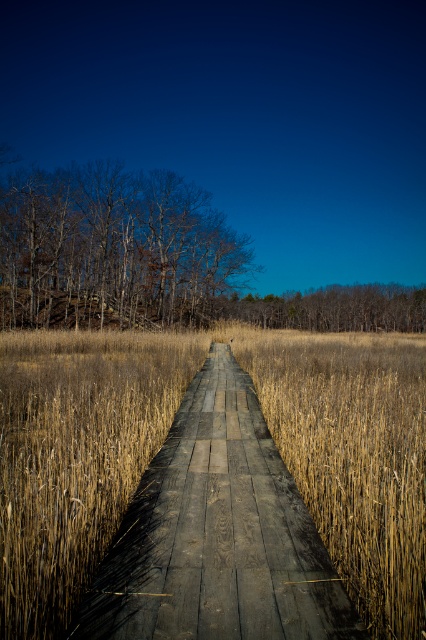
You are planning to place a small garden statue exactly in the middle between the dark gray wooden path at center and the smooth bark trees at left. Based on the scene description, can you determine which object the statue will be closer to?

The dark gray wooden path at center has a smaller size compared to smooth bark trees at left, so the statue will be closer to the dark gray wooden path at center since it is smaller in size and the distance between them depends on their sizes.

You are standing at the starting point of the boardwalk and want to reach a point marked as point (176,614). There is another point marked as point (45,314) further ahead. Which point is closer to you as you begin your walk?

Point (176,614) is closer to the camera than point (45,314), so the point you want to reach is closer to you as you start your walk.

You are standing at the starting point of the wooden boardwalk and want to reach the point marked at coordinate (218, 534). Based on the scene description, where exactly is this point located?

The point marked at coordinate (218, 534) is located on the dark gray wooden path at center.